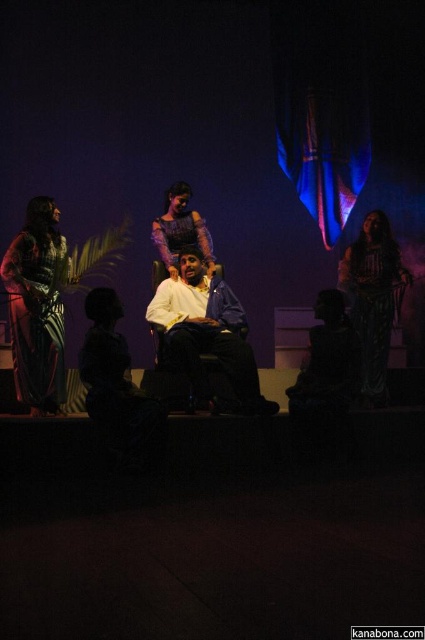
Question: Estimate the real-world distances between objects in this image. Which object is closer to the white matte shirt at center?

Choices:
 (A) plaid fabric dress at left
 (B) silky green dress at right
 (C) matte purple dress at center

Answer: (C)

Question: Does white matte shirt at center lie behind silky green dress at right?

Choices:
 (A) no
 (B) yes

Answer: (A)

Question: Which of the following is the closest to the observer?

Choices:
 (A) (385, 224)
 (B) (44, 324)
 (C) (189, 285)

Answer: (B)

Question: Estimate the real-world distances between objects in this image. Which object is farther from the silky green dress at right?

Choices:
 (A) white matte shirt at center
 (B) plaid fabric dress at left
 (C) matte purple dress at center

Answer: (B)

Question: From the image, what is the correct spatial relationship of plaid fabric dress at left in relation to silky green dress at right?

Choices:
 (A) below
 (B) above

Answer: (A)

Question: Does plaid fabric dress at left appear on the right side of silky green dress at right?

Choices:
 (A) yes
 (B) no

Answer: (B)